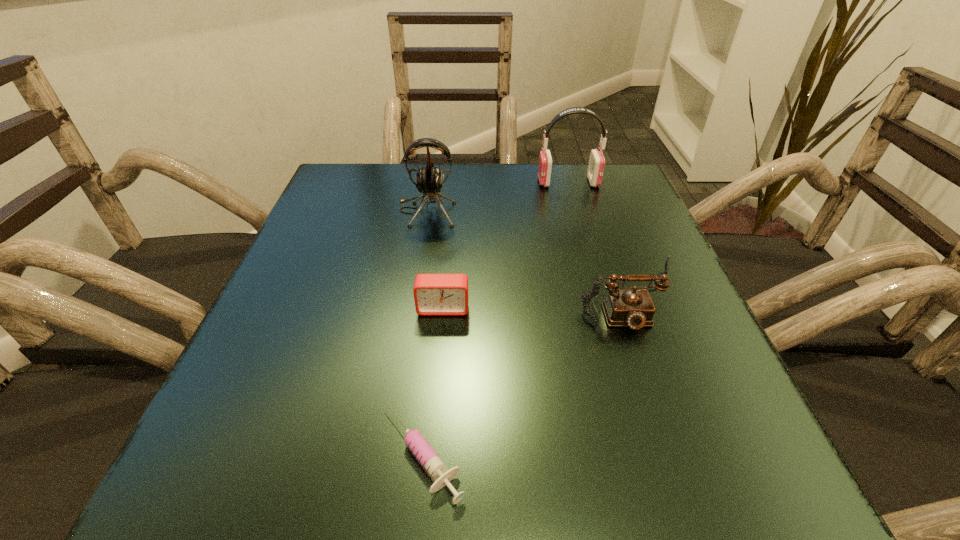
The width and height of the screenshot is (960, 540). I want to click on free spot between the farthest object and the fourth tallest object, so click(506, 245).

What are the coordinates of `free area in between the right earphone and the alarm clock` in the screenshot? It's located at (506, 245).

Find the location of a particular element. empty space that is in between the alarm clock and the right earphone is located at coordinates (506, 245).

Where is `free space between the farther earphone and the syringe`? free space between the farther earphone and the syringe is located at coordinates (495, 318).

Identify the location of object that stands as the fourth closest to the farther earphone. This screenshot has width=960, height=540. (432, 463).

Point out which object is positioned as the nearest to the nearer earphone. Please provide its 2D coordinates. Your answer should be formatted as a tuple, i.e. [(x, y)], where the tuple contains the x and y coordinates of a point satisfying the conditions above.

[(596, 165)]